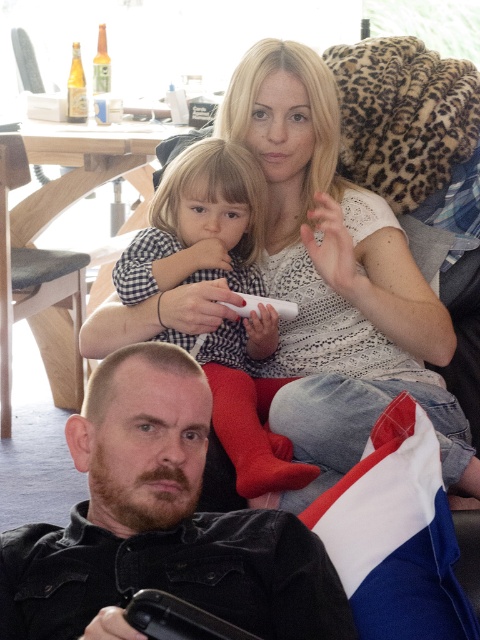
Question: Among these objects, which one is nearest to the camera?

Choices:
 (A) dark brown leather jacket at lower left
 (B) white lace shirt at upper center

Answer: (A)

Question: Which point is closer to the camera taking this photo?

Choices:
 (A) (259, 490)
 (B) (284, 310)

Answer: (A)

Question: Can you confirm if dark brown leather jacket at lower left is thinner than white plastic remote at center?

Choices:
 (A) no
 (B) yes

Answer: (A)

Question: Is white lace shirt at upper center positioned behind white plastic remote at center?

Choices:
 (A) yes
 (B) no

Answer: (B)

Question: Considering the real-world distances, which object is farthest from the checkered fabric shirt at upper center?

Choices:
 (A) white lace shirt at upper center
 (B) white plastic remote at center

Answer: (B)

Question: Is white lace shirt at upper center wider than white plastic remote at center?

Choices:
 (A) yes
 (B) no

Answer: (A)